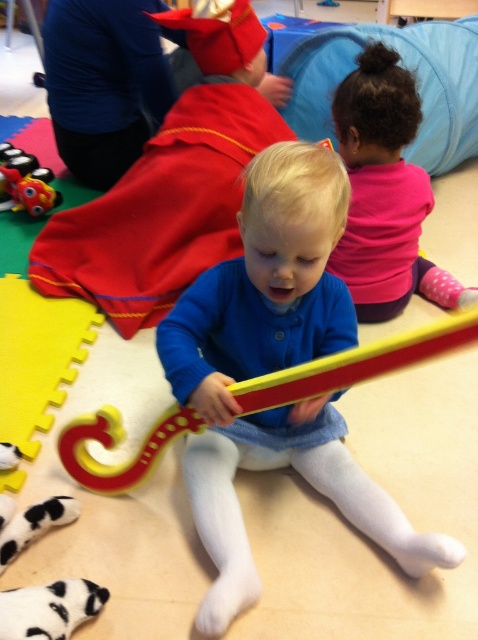
Can you confirm if pink soft fabric toddler at upper right is thinner than matte plastic train at left?

In fact, pink soft fabric toddler at upper right might be wider than matte plastic train at left.

Does pink soft fabric toddler at upper right come in front of matte plastic train at left?

Yes, it is.

Who is more forward, (354, 240) or (40, 180)?

Point (354, 240)

You are a GUI agent. You are given a task and a screenshot of the screen. Output one action in this format:
    pyautogui.click(x=<x>, y=<y>)
    Task: Click on the pink soft fabric toddler at upper right
    The height and width of the screenshot is (640, 478).
    Given the screenshot: What is the action you would take?
    pyautogui.click(x=384, y=193)

Does point (251, 424) come closer to viewer compared to point (32, 189)?

Yes, it is.

Who is more forward, (311, 269) or (32, 161)?

Positioned in front is point (311, 269).

You are a GUI agent. You are given a task and a screenshot of the screen. Output one action in this format:
    pyautogui.click(x=<x>, y=<y>)
    Task: Click on the blue soft sweater at center
    This screenshot has width=478, height=640.
    Given the screenshot: What is the action you would take?
    pyautogui.click(x=275, y=369)

In the scene shown: Which is below, blue soft sweater at center or pink soft fabric toddler at upper right?

blue soft sweater at center is below.

Who is taller, blue soft sweater at center or pink soft fabric toddler at upper right?

blue soft sweater at center

Identify the location of blue soft sweater at center. The height and width of the screenshot is (640, 478). (275, 369).